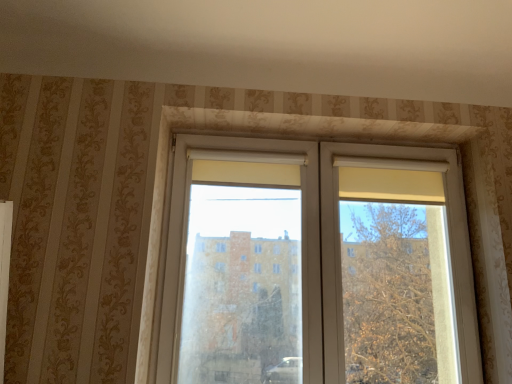
Image resolution: width=512 pixels, height=384 pixels. I want to click on white plastic window at center, so click(x=316, y=265).

Describe the element at coordinates (316, 265) in the screenshot. I see `white plastic window at center` at that location.

The width and height of the screenshot is (512, 384). Describe the element at coordinates (242, 264) in the screenshot. I see `white plastic screen door at center` at that location.

Measure the distance between point (x=263, y=294) and camera.

Point (x=263, y=294) is 1.95 meters from camera.

The width and height of the screenshot is (512, 384). In order to click on white plastic screen door at center in this screenshot , I will do `click(242, 264)`.

Identify the location of white plastic window at center. (316, 265).

Based on the photo, does white plastic screen door at center appear on the right side of white plastic window at center?

In fact, white plastic screen door at center is to the left of white plastic window at center.

Is the position of white plastic screen door at center less distant than that of white plastic window at center?

Yes.

Is point (274, 332) in front of point (158, 350)?

No, (274, 332) is further to viewer.

From the image's perspective, is white plastic screen door at center positioned above or below white plastic window at center?

white plastic screen door at center is situated lower than white plastic window at center in the image.

Looking at this image, from a real-world perspective, is white plastic screen door at center beneath white plastic window at center?

Correct, in the physical world, white plastic screen door at center is lower than white plastic window at center.

Is white plastic screen door at center thinner than white plastic window at center?

Incorrect, the width of white plastic screen door at center is not less than that of white plastic window at center.

Does white plastic screen door at center have a greater height compared to white plastic window at center?

Incorrect, the height of white plastic screen door at center is not larger of that of white plastic window at center.

Is white plastic screen door at center bigger or smaller than white plastic window at center?

white plastic screen door at center is bigger than white plastic window at center.

Would you say white plastic window at center is part of white plastic screen door at center's contents?

Absolutely, white plastic window at center is inside white plastic screen door at center.

Is white plastic screen door at center positioned far away from white plastic window at center?

No, white plastic screen door at center is in close proximity to white plastic window at center.

Is white plastic screen door at center positioned with its back to white plastic window at center?

That's right, white plastic screen door at center is facing away from white plastic window at center.

Locate an element on the screen. Image resolution: width=512 pixels, height=384 pixels. window behind the white plastic screen door at center is located at coordinates (x=316, y=265).

Is white plastic window at center at the right side of white plastic screen door at center?

Yes, white plastic window at center is to the right of white plastic screen door at center.

Relative to white plastic screen door at center, is white plastic window at center in front or behind?

white plastic window at center is behind white plastic screen door at center.

Between point (261, 326) and point (221, 239), which one is positioned behind?

Positioned behind is point (221, 239).

From the image's perspective, is white plastic window at center on top of white plastic screen door at center?

Correct, white plastic window at center appears higher than white plastic screen door at center in the image.

From a real-world perspective, relative to white plastic screen door at center, is white plastic window at center vertically above or below?

In terms of real-world spatial position, white plastic window at center is above white plastic screen door at center.

Is white plastic window at center wider or thinner than white plastic screen door at center?

Considering their sizes, white plastic window at center looks slimmer than white plastic screen door at center.

In terms of height, does white plastic window at center look taller or shorter compared to white plastic screen door at center?

Considering their sizes, white plastic window at center has more height than white plastic screen door at center.

Is white plastic window at center bigger than white plastic screen door at center?

No.

Would you say white plastic window at center is inside or outside white plastic screen door at center?

white plastic window at center is inside white plastic screen door at center.

Are white plastic window at center and white plastic screen door at center far apart?

Actually, white plastic window at center and white plastic screen door at center are a little close together.

Is white plastic window at center oriented away from white plastic screen door at center?

Yes, white plastic window at center's orientation is away from white plastic screen door at center.

How many degrees apart are the facing directions of white plastic window at center and white plastic screen door at center?

0.000658 degrees.

Measure the distance between white plastic window at center and white plastic screen door at center.

A distance of 4.57 inches exists between white plastic window at center and white plastic screen door at center.

You are a GUI agent. You are given a task and a screenshot of the screen. Output one action in this format:
    pyautogui.click(x=<x>, y=<y>)
    Task: Click on the screen door below the white plastic window at center (from the image's perspective)
    
    Given the screenshot: What is the action you would take?
    pyautogui.click(x=242, y=264)

Where is `screen door lying below the white plastic window at center (from the image's perspective)`? screen door lying below the white plastic window at center (from the image's perspective) is located at coordinates (242, 264).

This screenshot has width=512, height=384. Identify the location of screen door located in front of the white plastic window at center. (242, 264).